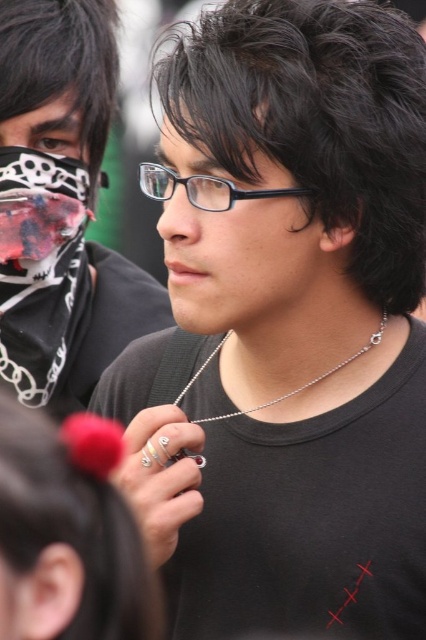
You are standing in front of the image and want to determine which of the two points, point (215,102) or point (20,577), is closer to you. Based on the scene, which point is nearer?

Point (215,102) is further to the viewer than point (20,577). Wait, no. The description says point (215,102) is further to the viewer than point (20,577). So the closer point would be point (20,577). Hmm, but the question asks which is nearer to you. The answer should be point (20,577) is closer because the other is further away. But the description says point A is further than point B, so point B is closer. So the answer is point (20,577) is nearer.

You are a jewelry designer observing the image. You need to determine which item has a greater width between the matte black mask at upper left and the silver chain necklace at center. Based on the scene, which one is wider?

The silver chain necklace at center is wider than the matte black mask at upper left.